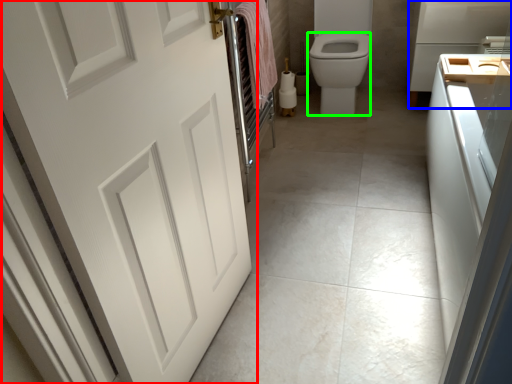
Question: Based on their relative distances, which object is farther from door (highlighted by a red box)? Choose from appliance (highlighted by a blue box) and bidet (highlighted by a green box).

Choices:
 (A) appliance
 (B) bidet

Answer: (A)